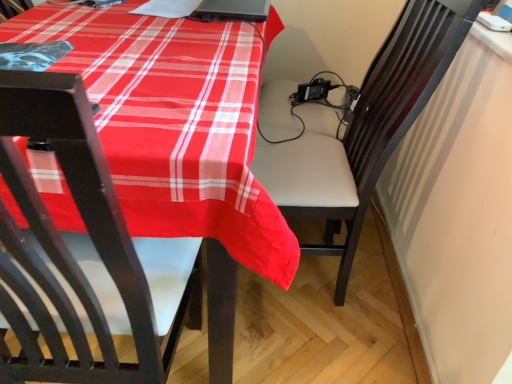
Question: Considering the positions of point (403, 109) and point (266, 4), is point (403, 109) closer or farther from the camera than point (266, 4)?

Choices:
 (A) farther
 (B) closer

Answer: (B)

Question: From the image's perspective, is white leather chair at center located above or below black matte laptop at upper center?

Choices:
 (A) above
 (B) below

Answer: (B)

Question: Based on their sizes in the image, would you say white leather chair at center is bigger or smaller than black matte laptop at upper center?

Choices:
 (A) big
 (B) small

Answer: (A)

Question: Relative to white leather chair at center, is black matte laptop at upper center in front or behind?

Choices:
 (A) behind
 (B) front

Answer: (A)

Question: Is black matte laptop at upper center bigger or smaller than white leather chair at center?

Choices:
 (A) big
 (B) small

Answer: (B)

Question: Looking at their shapes, would you say black matte laptop at upper center is wider or thinner than white leather chair at center?

Choices:
 (A) thin
 (B) wide

Answer: (A)

Question: Considering the positions of black matte laptop at upper center and white leather chair at center in the image, is black matte laptop at upper center taller or shorter than white leather chair at center?

Choices:
 (A) short
 (B) tall

Answer: (A)